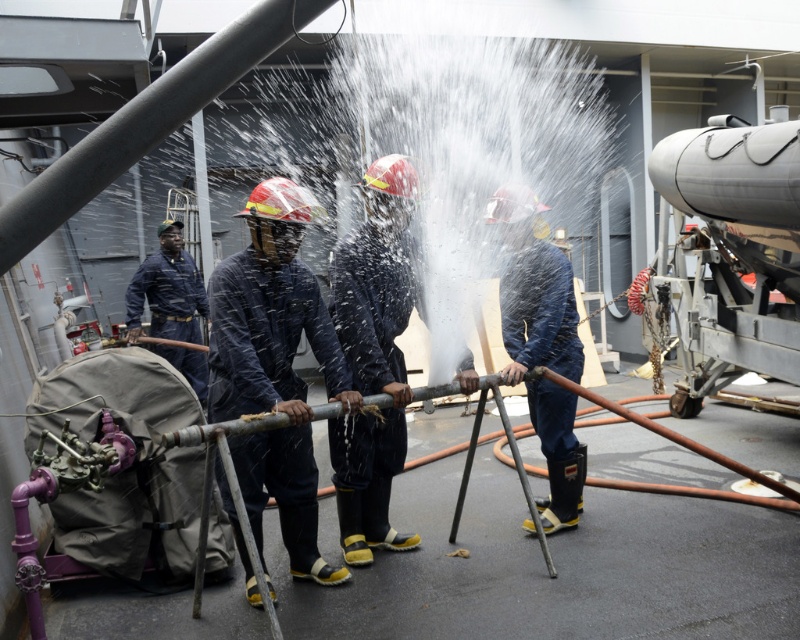
Question: Is dark blue uniform at center positioned before blue rubber boots at center?

Choices:
 (A) no
 (B) yes

Answer: (B)

Question: Can you confirm if dark blue uniform at center is positioned below blue rubber boots at center?

Choices:
 (A) yes
 (B) no

Answer: (A)

Question: Which point is farther to the camera?

Choices:
 (A) blue rubber boots at center
 (B) dark blue uniform at center

Answer: (A)

Question: Can you confirm if dark blue uniform at center is positioned to the right of blue rubber boots at center?

Choices:
 (A) no
 (B) yes

Answer: (A)

Question: Which point is closer to the camera?

Choices:
 (A) dark blue uniform at center
 (B) blue rubber boots at center

Answer: (A)